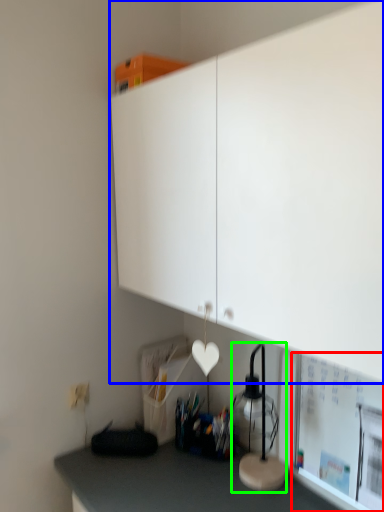
Question: Estimate the real-world distances between objects in this image. Which object is closer to bulletin board (highlighted by a red box), cabinetry (highlighted by a blue box) or table lamp (highlighted by a green box)?

Choices:
 (A) cabinetry
 (B) table lamp

Answer: (B)